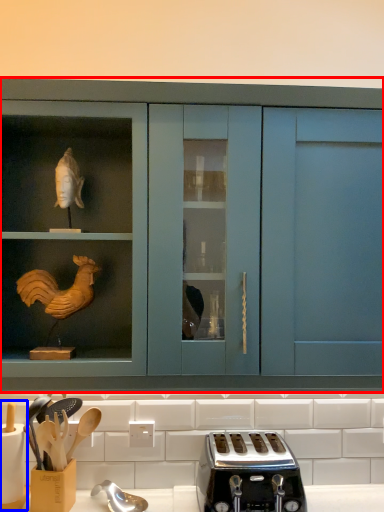
Question: Which object is further to the camera taking this photo, cabinetry (highlighted by a red box) or appliance (highlighted by a blue box)?

Choices:
 (A) cabinetry
 (B) appliance

Answer: (B)